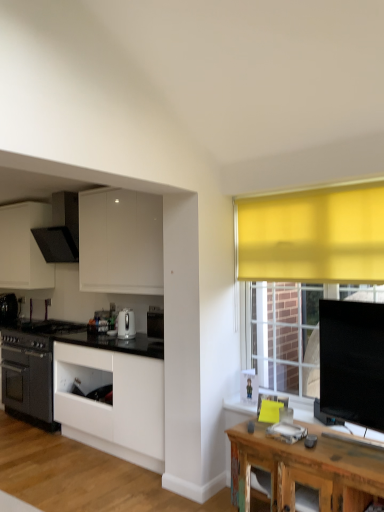
Describe the element at coordinates (113, 403) in the screenshot. I see `white glossy cabinet at center, positioned as the 1th cabinetry in bottom-to-top order` at that location.

What do you see at coordinates (60, 230) in the screenshot?
I see `matte black range hood at upper left, the 3th kitchen appliance ordered from the bottom` at bounding box center [60, 230].

What do you see at coordinates (8, 309) in the screenshot? I see `black matte oven at left, the third kitchen appliance viewed from the top` at bounding box center [8, 309].

This screenshot has width=384, height=512. Describe the element at coordinates (310, 469) in the screenshot. I see `rustic wood table at lower right` at that location.

Measure the distance between point (11, 218) and camera.

They are 5.48 meters apart.

Describe the element at coordinates (24, 247) in the screenshot. I see `white matte cabinet at upper left, which is the 2th cabinetry in right-to-left order` at that location.

Identify the location of white glossy cabinet at center, the first cabinetry in the front-to-back sequence. Image resolution: width=384 pixels, height=512 pixels. (113, 403).

Does rustic wood table at lower right turn towards matte black range hood at upper left, the 2th kitchen appliance in the back-to-front sequence?

No.

Which object is closer to the camera taking this photo, rustic wood table at lower right or matte black range hood at upper left, the 2th kitchen appliance from the front?

rustic wood table at lower right is more forward.

Can matte black range hood at upper left, the 3th kitchen appliance ordered from the bottom, be found inside rustic wood table at lower right?

No, matte black range hood at upper left, the 3th kitchen appliance ordered from the bottom, is not inside rustic wood table at lower right.

Is matte black range hood at upper left, the 2th kitchen appliance from the front, touching white matte cabinet at upper left, which ranks as the 2th cabinetry in bottom-to-top order?

No.

From a real-world perspective, who is located higher, matte black range hood at upper left, the 2th kitchen appliance in the back-to-front sequence, or white matte cabinet at upper left, placed as the first cabinetry when sorted from top to bottom?

From a 3D spatial view, matte black range hood at upper left, the 2th kitchen appliance in the back-to-front sequence, is above.

Is white glossy kettle at center, which appears as the 3th kitchen appliance when viewed from the back, at the left side of white glossy cabinet at center, the second cabinetry in the top-to-bottom sequence?

Yes, white glossy kettle at center, which appears as the 3th kitchen appliance when viewed from the back, is to the left of white glossy cabinet at center, the second cabinetry in the top-to-bottom sequence.

Looking at this image, considering the sizes of objects white glossy kettle at center, which is counted as the 2th kitchen appliance, starting from the bottom, and white glossy cabinet at center, which is the 1th cabinetry from right to left, in the image provided, who is smaller, white glossy kettle at center, which is counted as the 2th kitchen appliance, starting from the bottom, or white glossy cabinet at center, which is the 1th cabinetry from right to left,?

white glossy kettle at center, which is counted as the 2th kitchen appliance, starting from the bottom, is smaller.

Is white glossy kettle at center, the 2th kitchen appliance in the top-to-bottom sequence, oriented towards white glossy cabinet at center, positioned as the 1th cabinetry in bottom-to-top order?

No, white glossy kettle at center, the 2th kitchen appliance in the top-to-bottom sequence, is not facing towards white glossy cabinet at center, positioned as the 1th cabinetry in bottom-to-top order.

Based on the photo, from a real-world perspective, between white glossy kettle at center, the third kitchen appliance in the left-to-right sequence, and white glossy cabinet at center, positioned as the 1th cabinetry in bottom-to-top order, who is vertically higher?

white glossy kettle at center, the third kitchen appliance in the left-to-right sequence.

Can you confirm if matte black range hood at upper left, the 2th kitchen appliance in the back-to-front sequence, is positioned to the left of rustic wood table at lower right?

Yes.

What's the angular difference between matte black range hood at upper left, the 2th kitchen appliance in the right-to-left sequence, and rustic wood table at lower right's facing directions?

1.73 degrees separate the facing orientations of matte black range hood at upper left, the 2th kitchen appliance in the right-to-left sequence, and rustic wood table at lower right.

Is matte black range hood at upper left, the 2th kitchen appliance in the right-to-left sequence, placed right next to rustic wood table at lower right?

matte black range hood at upper left, the 2th kitchen appliance in the right-to-left sequence, and rustic wood table at lower right are clearly separated.

Does rustic wood table at lower right contain white glossy cabinet at center, which is the 1th cabinetry from right to left?

No, white glossy cabinet at center, which is the 1th cabinetry from right to left, is not surrounded by rustic wood table at lower right.

From the picture: Can you confirm if rustic wood table at lower right is smaller than white glossy cabinet at center, positioned as the 1th cabinetry in bottom-to-top order?

Yes, rustic wood table at lower right is smaller than white glossy cabinet at center, positioned as the 1th cabinetry in bottom-to-top order.

Is there a large distance between rustic wood table at lower right and white glossy cabinet at center, which is the 1th cabinetry from right to left?

Absolutely, rustic wood table at lower right is distant from white glossy cabinet at center, which is the 1th cabinetry from right to left.

Would you say white glossy cabinet at center, the second cabinetry when ordered from back to front, is to the left or to the right of white glossy kettle at center, which appears as the 3th kitchen appliance when viewed from the back, in the picture?

From the image, it's evident that white glossy cabinet at center, the second cabinetry when ordered from back to front, is to the right of white glossy kettle at center, which appears as the 3th kitchen appliance when viewed from the back.

Considering the sizes of objects white glossy cabinet at center, the second cabinetry in the top-to-bottom sequence, and white glossy kettle at center, which appears as the 3th kitchen appliance when viewed from the back, in the image provided, who is thinner, white glossy cabinet at center, the second cabinetry in the top-to-bottom sequence, or white glossy kettle at center, which appears as the 3th kitchen appliance when viewed from the back,?

Thinner between the two is white glossy kettle at center, which appears as the 3th kitchen appliance when viewed from the back.

From a real-world perspective, is white glossy cabinet at center, positioned as the 1th cabinetry in bottom-to-top order, located beneath white glossy kettle at center, which appears as the 3th kitchen appliance when viewed from the back?

Yes.

Which is nearer, [73,365] or [120,337]?

Point [73,365] is farther from the camera than point [120,337].

Which object is more forward, white glossy kettle at center, the third kitchen appliance in the left-to-right sequence, or white matte cabinet at upper left, arranged as the first cabinetry when viewed from the left?

white glossy kettle at center, the third kitchen appliance in the left-to-right sequence, is in front.

Is point (132, 322) more distant than point (24, 230)?

No, it is in front of (24, 230).

Image resolution: width=384 pixels, height=512 pixels. Find the location of `cabinetry above the white glossy kettle at center, which is counted as the 2th kitchen appliance, starting from the bottom (from the image's perspective)`. cabinetry above the white glossy kettle at center, which is counted as the 2th kitchen appliance, starting from the bottom (from the image's perspective) is located at coordinates (24, 247).

The height and width of the screenshot is (512, 384). I want to click on table directly beneath the matte black range hood at upper left, which appears as the first kitchen appliance when viewed from the top (from a real-world perspective), so click(x=310, y=469).

The height and width of the screenshot is (512, 384). Identify the location of kitchen appliance above the white matte cabinet at upper left, the 2th cabinetry when ordered from front to back (from a real-world perspective). (60, 230).

When comparing their distances from matte black range hood at upper left, the 2th kitchen appliance in the back-to-front sequence, does rustic wood table at lower right or white glossy cabinet at center, marked as the second cabinetry in a left-to-right arrangement, seem further?

rustic wood table at lower right is positioned further to the anchor matte black range hood at upper left, the 2th kitchen appliance in the back-to-front sequence.

Looking at the image, which one is located closer to rustic wood table at lower right, white matte cabinet at upper left, which ranks as the 2th cabinetry in bottom-to-top order, or matte black range hood at upper left, the 3th kitchen appliance ordered from the bottom?

matte black range hood at upper left, the 3th kitchen appliance ordered from the bottom.

Based on their spatial positions, is black matte oven at left, positioned as the 1th kitchen appliance in back-to-front order, or matte black range hood at upper left, the 2th kitchen appliance from the front, closer to rustic wood table at lower right?

matte black range hood at upper left, the 2th kitchen appliance from the front.

From the image, which object appears to be farther from matte black range hood at upper left, the 3th kitchen appliance ordered from the bottom, black matte oven at left, the 3th kitchen appliance when ordered from front to back, or white glossy cabinet at center, the second cabinetry in the top-to-bottom sequence?

Based on the image, white glossy cabinet at center, the second cabinetry in the top-to-bottom sequence, appears to be further to matte black range hood at upper left, the 3th kitchen appliance ordered from the bottom.

Based on their spatial positions, is white glossy kettle at center, which is counted as the 2th kitchen appliance, starting from the bottom, or rustic wood table at lower right closer to black matte oven at left, the 3th kitchen appliance when ordered from front to back?

white glossy kettle at center, which is counted as the 2th kitchen appliance, starting from the bottom, is positioned closer to the anchor black matte oven at left, the 3th kitchen appliance when ordered from front to back.

Considering their positions, is black matte oven at left, which is the 1th kitchen appliance from left to right, positioned further to white glossy cabinet at center, the second cabinetry when ordered from back to front, than rustic wood table at lower right?

The object further to white glossy cabinet at center, the second cabinetry when ordered from back to front, is black matte oven at left, which is the 1th kitchen appliance from left to right.

Looking at the image, which one is located further to white glossy kettle at center, the 2th kitchen appliance in the top-to-bottom sequence, matte black range hood at upper left, the 2th kitchen appliance in the right-to-left sequence, or white matte cabinet at upper left, which is the 2th cabinetry in right-to-left order?

white matte cabinet at upper left, which is the 2th cabinetry in right-to-left order, is further to white glossy kettle at center, the 2th kitchen appliance in the top-to-bottom sequence.

From the image, which object appears to be nearer to white glossy cabinet at center, the second cabinetry in the top-to-bottom sequence, rustic wood table at lower right or black matte oven at left, positioned as the 1th kitchen appliance in bottom-to-top order?

Among the two, rustic wood table at lower right is located nearer to white glossy cabinet at center, the second cabinetry in the top-to-bottom sequence.

Where is `cabinetry located between rustic wood table at lower right and white glossy kettle at center, the third kitchen appliance in the left-to-right sequence, in the depth direction`? This screenshot has height=512, width=384. cabinetry located between rustic wood table at lower right and white glossy kettle at center, the third kitchen appliance in the left-to-right sequence, in the depth direction is located at coordinates (113, 403).

What are the coordinates of `cabinetry located between white glossy cabinet at center, positioned as the 1th cabinetry in bottom-to-top order, and black matte oven at left, acting as the third kitchen appliance starting from the right, in the depth direction` in the screenshot? It's located at (24, 247).

The image size is (384, 512). I want to click on cabinetry situated between black matte oven at left, which is the 1th kitchen appliance from left to right, and matte black range hood at upper left, which appears as the first kitchen appliance when viewed from the top, from left to right, so click(x=24, y=247).

Where is `kitchen appliance located between rustic wood table at lower right and matte black range hood at upper left, which is the second kitchen appliance from left to right, in the depth direction`? kitchen appliance located between rustic wood table at lower right and matte black range hood at upper left, which is the second kitchen appliance from left to right, in the depth direction is located at coordinates (126, 324).